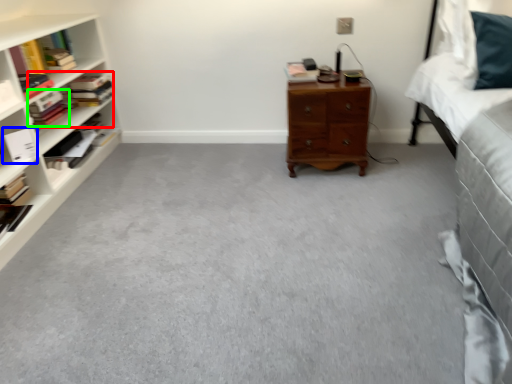
Question: Estimate the real-world distances between objects in this image. Which object is farther from book (highlighted by a red box), book (highlighted by a blue box) or book (highlighted by a green box)?

Choices:
 (A) book
 (B) book

Answer: (A)